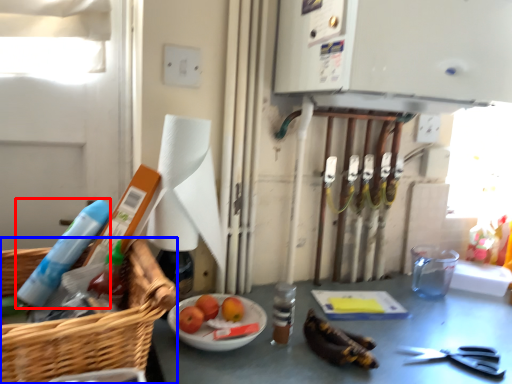
Question: Which point is closer to the camera, cleaning product (highlighted by a red box) or basket (highlighted by a blue box)?

Choices:
 (A) cleaning product
 (B) basket

Answer: (B)